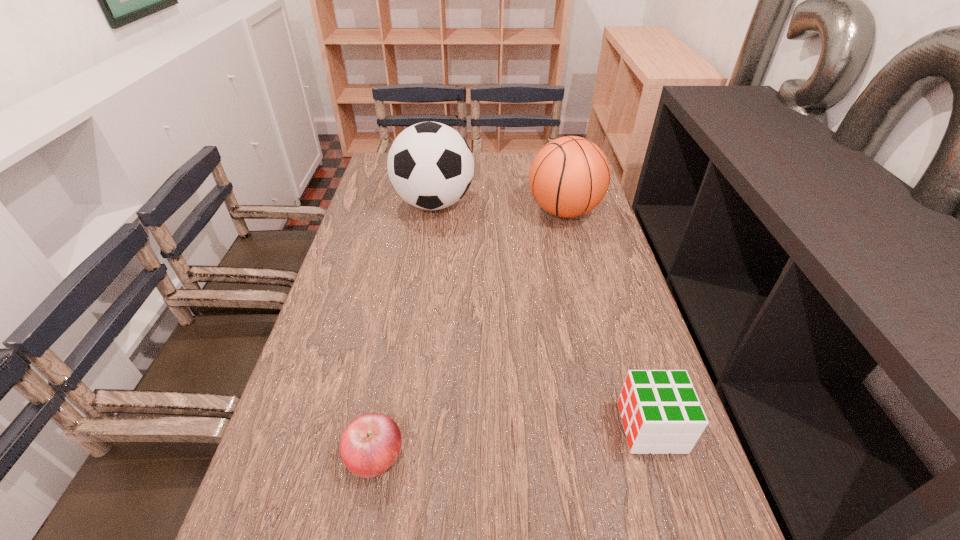
Where is `soccer ball situated at the left edge`? The height and width of the screenshot is (540, 960). soccer ball situated at the left edge is located at coordinates (430, 165).

This screenshot has height=540, width=960. What are the coordinates of `apple at the left edge` in the screenshot? It's located at (370, 444).

Where is `basketball situated at the right edge`? basketball situated at the right edge is located at coordinates (569, 177).

The width and height of the screenshot is (960, 540). Identify the location of cube positioned at the right edge. (661, 413).

Locate an element on the screen. vacant space at the far edge of the desktop is located at coordinates (477, 178).

Identify the location of vacant space at the left edge. (363, 226).

I want to click on free region at the right edge, so click(x=610, y=240).

This screenshot has width=960, height=540. In order to click on vacant area between the cube and the apple in this screenshot , I will do `click(513, 442)`.

In order to click on vacant space in between the apple and the basketball in this screenshot , I will do `click(469, 334)`.

Identify the location of free point between the apple and the soccer ball. coord(404,329).